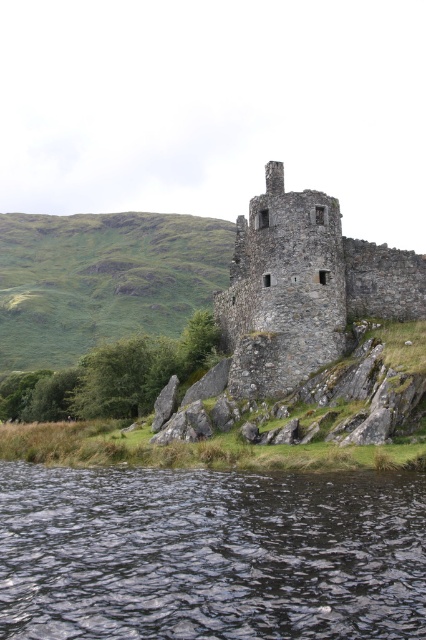
Question: Is dark liquid water at lower center bigger than rustic stone tower at center?

Choices:
 (A) no
 (B) yes

Answer: (A)

Question: Is dark liquid water at lower center in front of rustic stone tower at center?

Choices:
 (A) no
 (B) yes

Answer: (B)

Question: Among these objects, which one is nearest to the camera?

Choices:
 (A) dark liquid water at lower center
 (B) rustic stone tower at center

Answer: (A)

Question: Is dark liquid water at lower center bigger than rustic stone tower at center?

Choices:
 (A) no
 (B) yes

Answer: (A)

Question: Among these objects, which one is nearest to the camera?

Choices:
 (A) dark liquid water at lower center
 (B) rustic stone tower at center

Answer: (A)